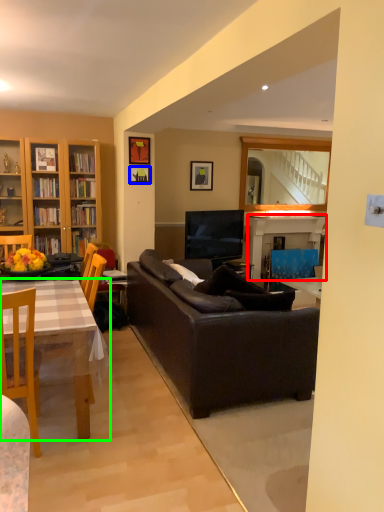
Question: Which object is positioned farthest from fireplace (highlighted by a red box)? Select from picture frame (highlighted by a blue box) and desk (highlighted by a green box).

Choices:
 (A) picture frame
 (B) desk

Answer: (B)